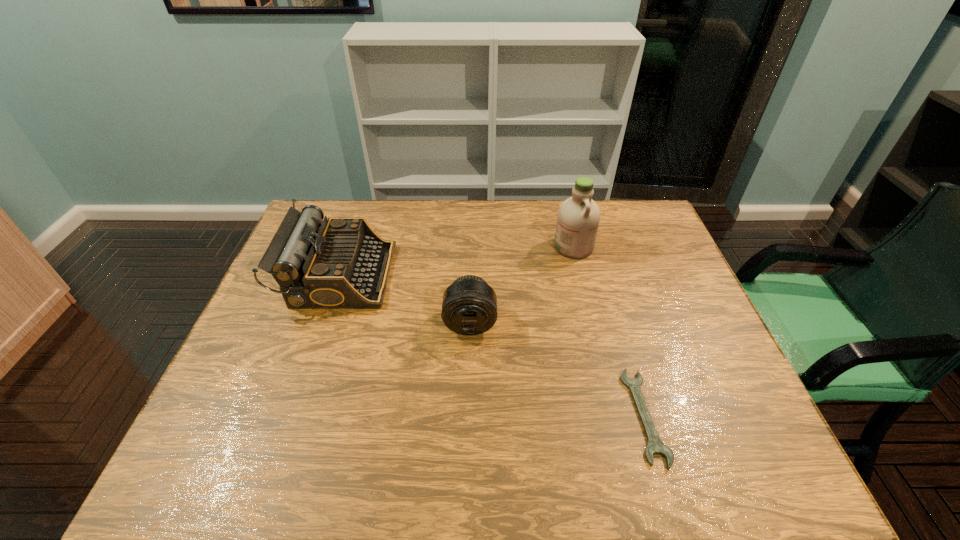
At what (x,y) coordinates should I click in order to perform the action: click on vacant region between the leftmost object and the shortest object. Please return your answer as a coordinate pair (x, y). This screenshot has width=960, height=540. Looking at the image, I should click on (492, 346).

Locate an element on the screen. This screenshot has height=540, width=960. vacant space in between the nearest object and the second shortest object is located at coordinates (558, 369).

Identify which object is located as the nearest to the leftmost object. Please provide its 2D coordinates. Your answer should be formatted as a tuple, i.e. [(x, y)], where the tuple contains the x and y coordinates of a point satisfying the conditions above.

[(469, 307)]

Select which object appears as the closest to the tallest object. Please provide its 2D coordinates. Your answer should be formatted as a tuple, i.e. [(x, y)], where the tuple contains the x and y coordinates of a point satisfying the conditions above.

[(469, 307)]

Where is `vacant point that satisfies the following two spatial constraints: 1. on the back side of the nearest object; 2. on the front label of the cleansing agent`? The image size is (960, 540). vacant point that satisfies the following two spatial constraints: 1. on the back side of the nearest object; 2. on the front label of the cleansing agent is located at coordinates (594, 246).

This screenshot has height=540, width=960. I want to click on free space that satisfies the following two spatial constraints: 1. on the keyboard of the leftmost object; 2. on the left side of the shortest object, so click(291, 416).

I want to click on blank space that satisfies the following two spatial constraints: 1. on the front-facing side of the telephoto lens; 2. on the left side of the nearest object, so click(468, 416).

Image resolution: width=960 pixels, height=540 pixels. What are the coordinates of `free point that satisfies the following two spatial constraints: 1. on the back side of the nearest object; 2. on the keyboard of the second tallest object` in the screenshot? It's located at (603, 275).

Locate an element on the screen. The image size is (960, 540). free space that satisfies the following two spatial constraints: 1. on the front label of the tallest object; 2. on the front-facing side of the third tallest object is located at coordinates (592, 323).

Identify the location of vacant point that satisfies the following two spatial constraints: 1. on the front label of the cleansing agent; 2. on the front-facing side of the second shortest object. The width and height of the screenshot is (960, 540). (592, 323).